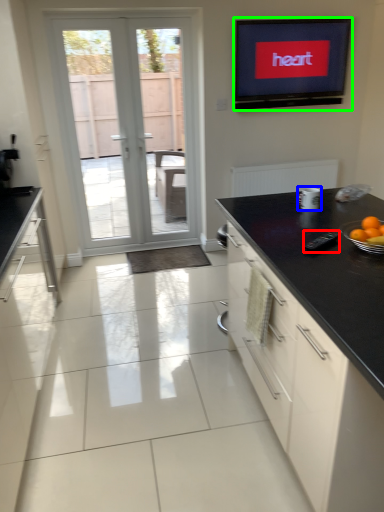
Question: Which is nearer to the appliance (highlighted by a red box)? appliance (highlighted by a blue box) or electronic (highlighted by a green box).

Choices:
 (A) appliance
 (B) electronic

Answer: (A)